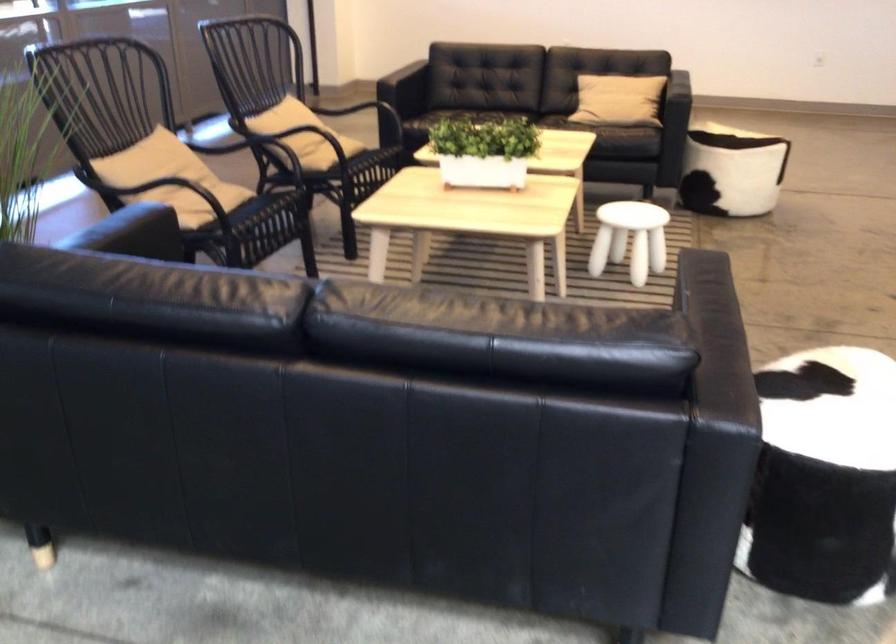
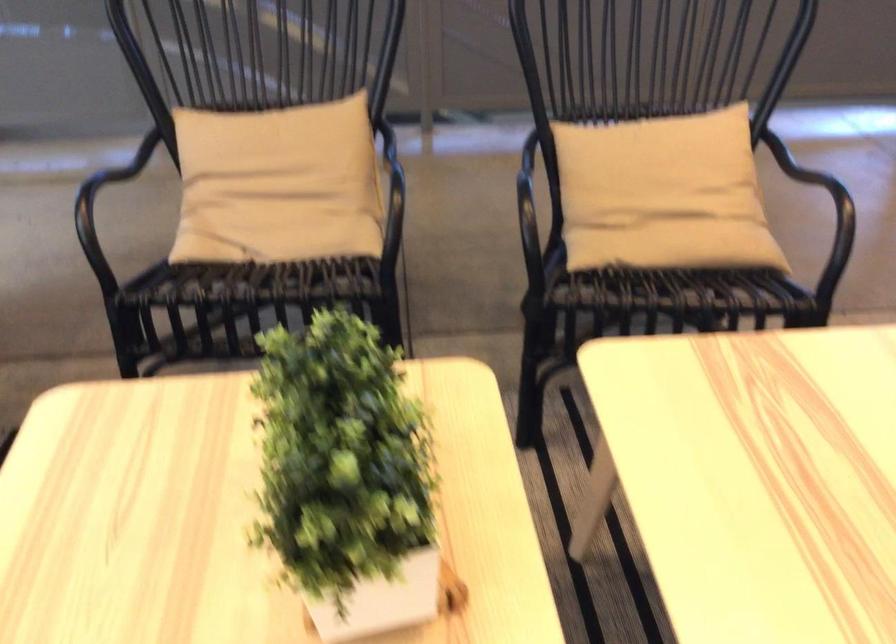
The point at (512, 128) is marked in the first image. Where is the corresponding point in the second image?

(346, 477)